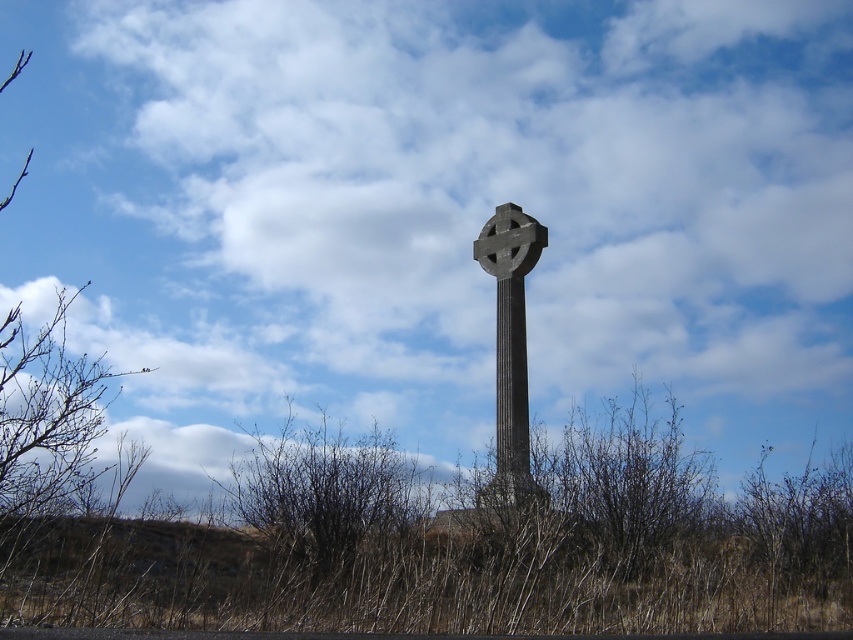
Locate an element on the screen. brown dry grass at center is located at coordinates (460, 545).

Is point (730, 540) less distant than point (540, 248)?

Yes, it is in front of point (540, 248).

In order to click on brown dry grass at center in this screenshot , I will do `click(460, 545)`.

You are a GUI agent. You are given a task and a screenshot of the screen. Output one action in this format:
    pyautogui.click(x=<x>, y=<y>)
    Task: Click on the brown dry grass at center
    The image size is (853, 640).
    Given the screenshot: What is the action you would take?
    pyautogui.click(x=460, y=545)

Who is higher up, brown dry grass at lower center or gray stone cross at center?

gray stone cross at center is higher up.

Does point (387, 506) lie behind point (508, 208)?

That is False.

Does point (291, 422) lie in front of point (515, 412)?

Yes, point (291, 422) is in front of point (515, 412).

This screenshot has height=640, width=853. Identify the location of brown dry grass at lower center. (328, 497).

Between brown dry grass at center and brown dry grass at lower center, which one is positioned lower?

brown dry grass at center is lower down.

Can you confirm if brown dry grass at center is thinner than brown dry grass at lower center?

In fact, brown dry grass at center might be wider than brown dry grass at lower center.

Which is in front, point (322, 516) or point (318, 576)?

Point (318, 576) is more forward.

Identify the location of brown dry grass at center. point(460,545).